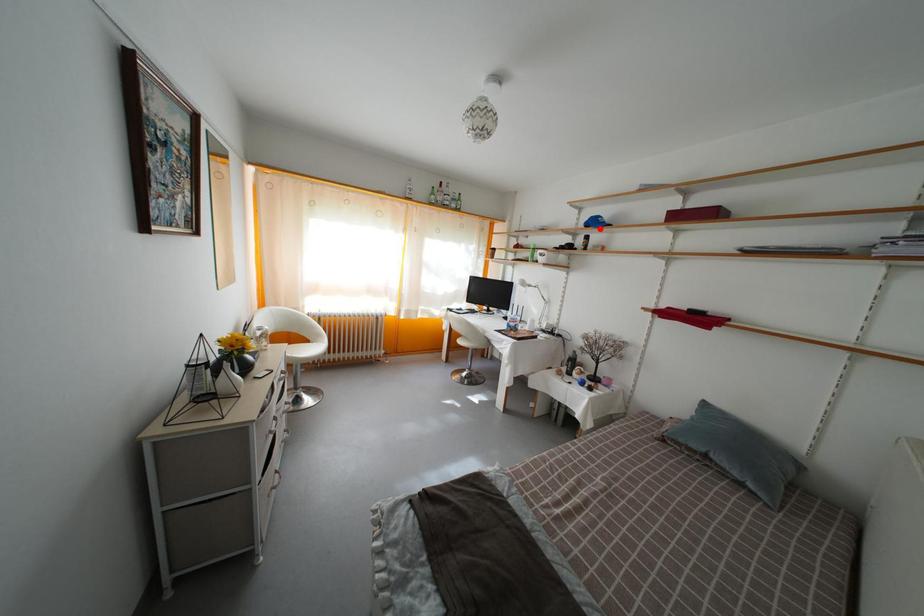
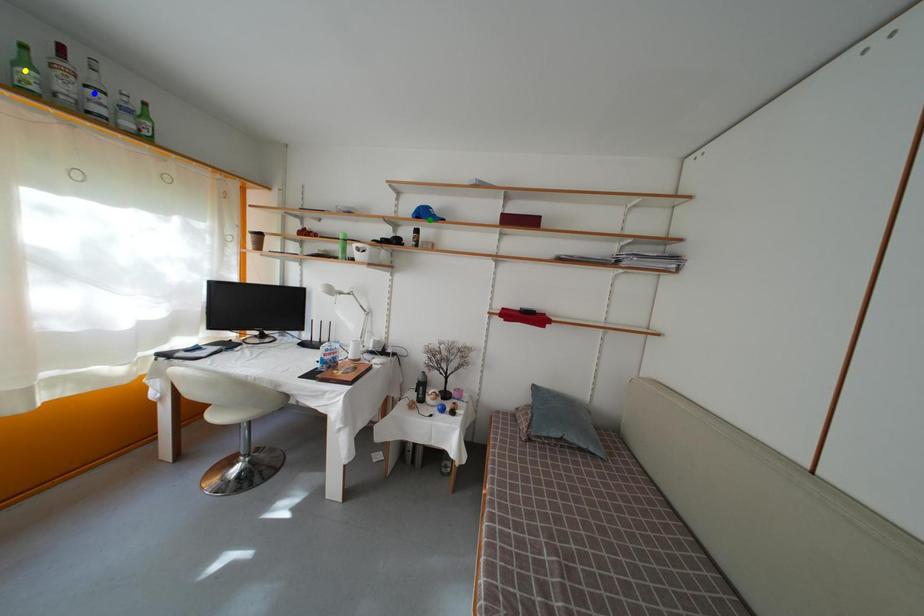
Question: I am providing you with two images of the same scene from different viewpoints. A red point is marked on the first image. You are given multiple points on the second image. Can you choose the point in image 2 that corresponds to the point in image 1?

Choices:
 (A) blue point
 (B) green point
 (C) yellow point

Answer: (B)